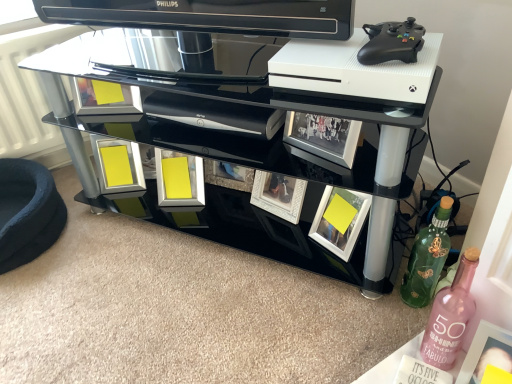
At what (x,y) coordinates should I click in order to perform the action: click on free space in front of black glass tv stand at center. Please return your answer as a coordinate pair (x, y). Image resolution: width=512 pixels, height=384 pixels. Looking at the image, I should click on (233, 315).